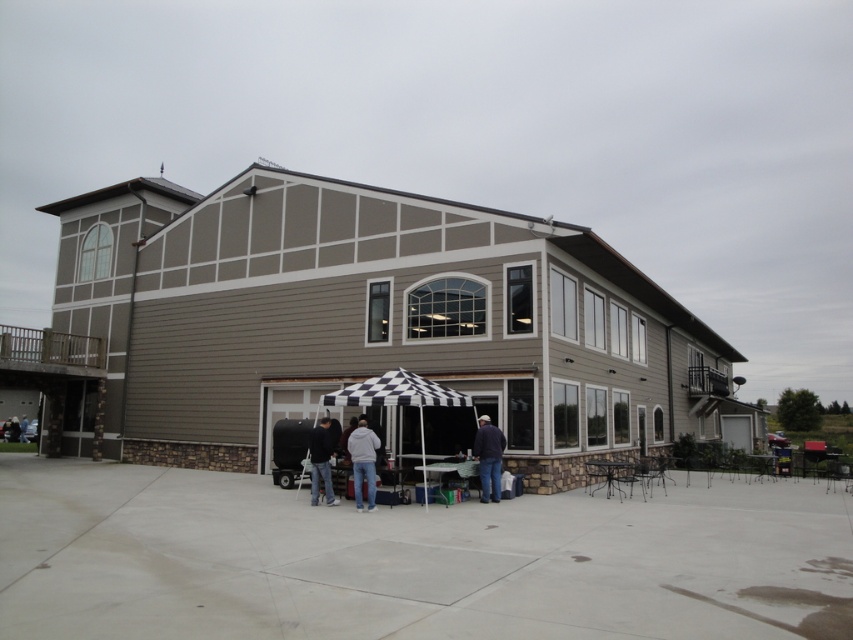
Question: Is black checkered umbrella at center wider than black fabric umbrella at center?

Choices:
 (A) no
 (B) yes

Answer: (B)

Question: Which object is farther from the camera taking this photo?

Choices:
 (A) dark blue jacket at lower center
 (B) dark gray sweater at center

Answer: (B)

Question: Which point is closer to the camera?

Choices:
 (A) dark gray hoodie at lower center
 (B) black checkered umbrella at center

Answer: (A)

Question: Can you confirm if dark blue jacket at lower center is positioned below black fabric person at lower left?

Choices:
 (A) no
 (B) yes

Answer: (A)

Question: Does black checkered umbrella at center have a smaller size compared to dark gray hoodie at lower center?

Choices:
 (A) yes
 (B) no

Answer: (A)

Question: Among these objects, which one is nearest to the camera?

Choices:
 (A) light gray hoodie at center
 (B) black fabric umbrella at center

Answer: (A)